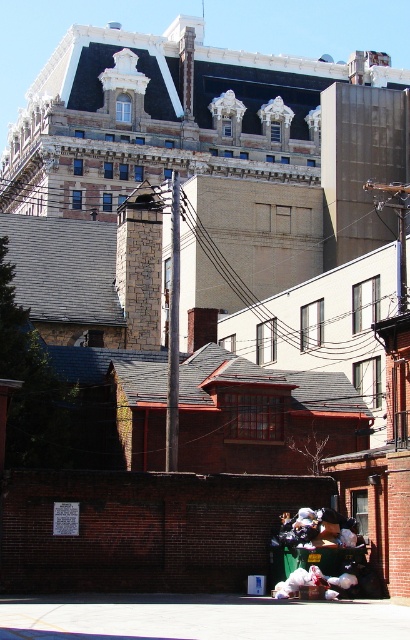
Question: Which point is farther from the camera taking this photo?

Choices:
 (A) (173, 364)
 (B) (298, 516)

Answer: (A)

Question: Which point appears closest to the camera in this image?

Choices:
 (A) (312, 538)
 (B) (172, 225)

Answer: (A)

Question: Is smooth gray pole at center thinner than black plastic bags at lower center?

Choices:
 (A) no
 (B) yes

Answer: (A)

Question: Which object is farther from the camera taking this photo?

Choices:
 (A) black plastic bags at lower center
 (B) smooth gray pole at center

Answer: (B)

Question: Does smooth gray pole at center appear on the left side of black plastic bags at lower center?

Choices:
 (A) yes
 (B) no

Answer: (A)

Question: Can you confirm if smooth gray pole at center is bigger than black plastic bags at lower center?

Choices:
 (A) no
 (B) yes

Answer: (B)